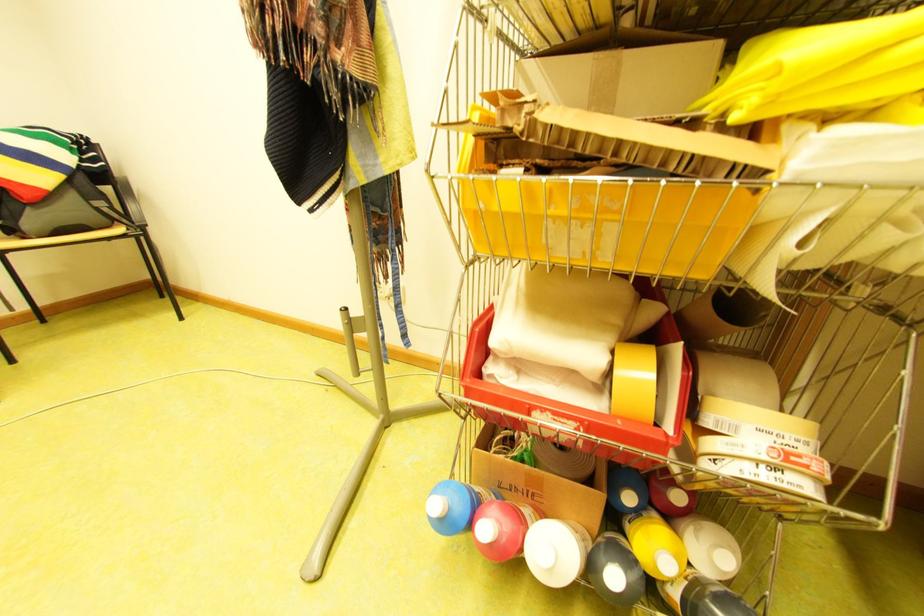
What do you see at coordinates (59, 238) in the screenshot? I see `a chair sitting surface` at bounding box center [59, 238].